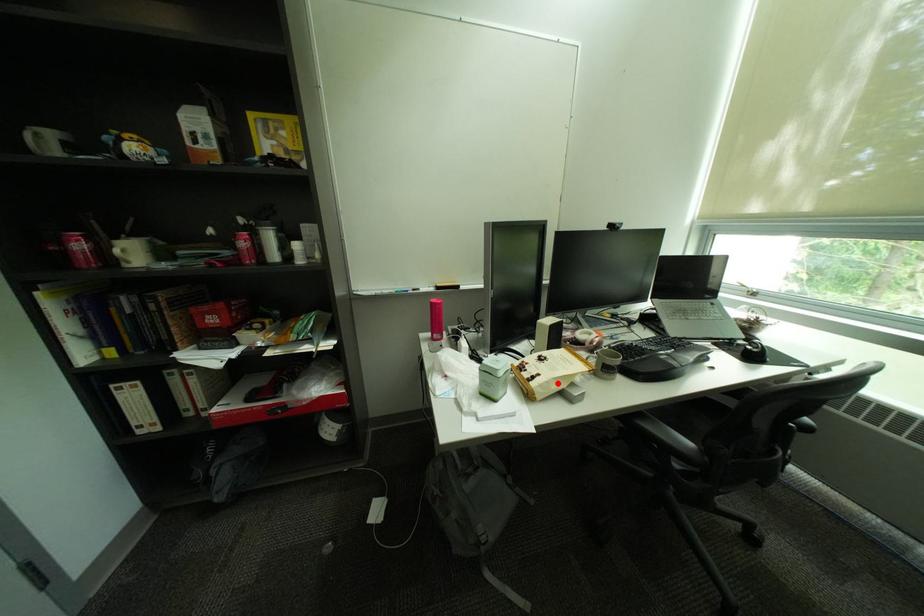
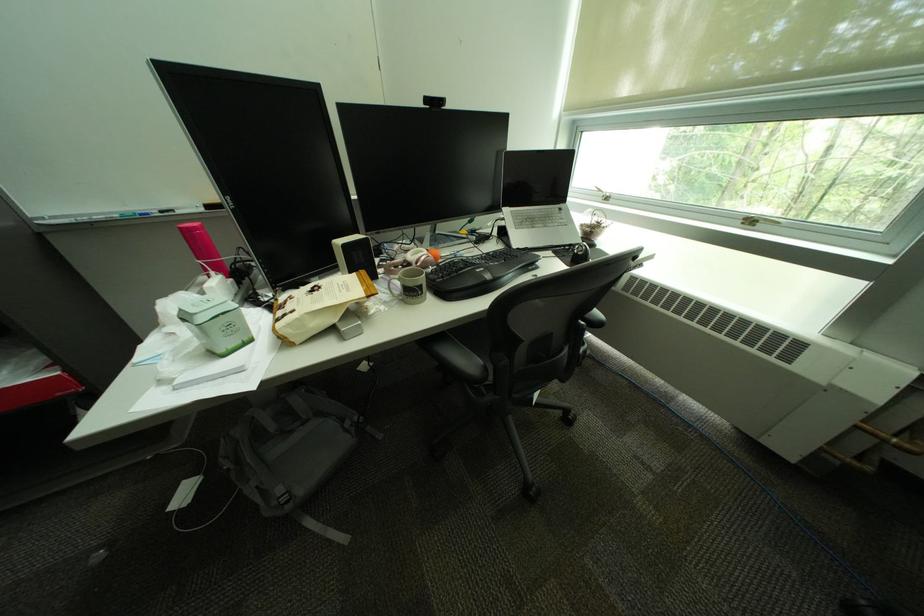
Locate, in the second image, the point that corresponds to the highlighted location in the first image.

(309, 321)